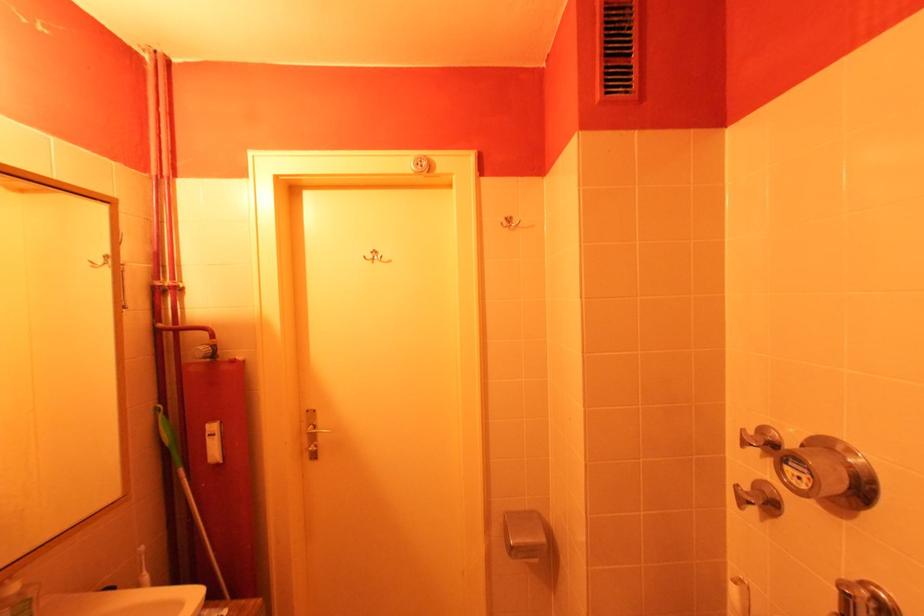
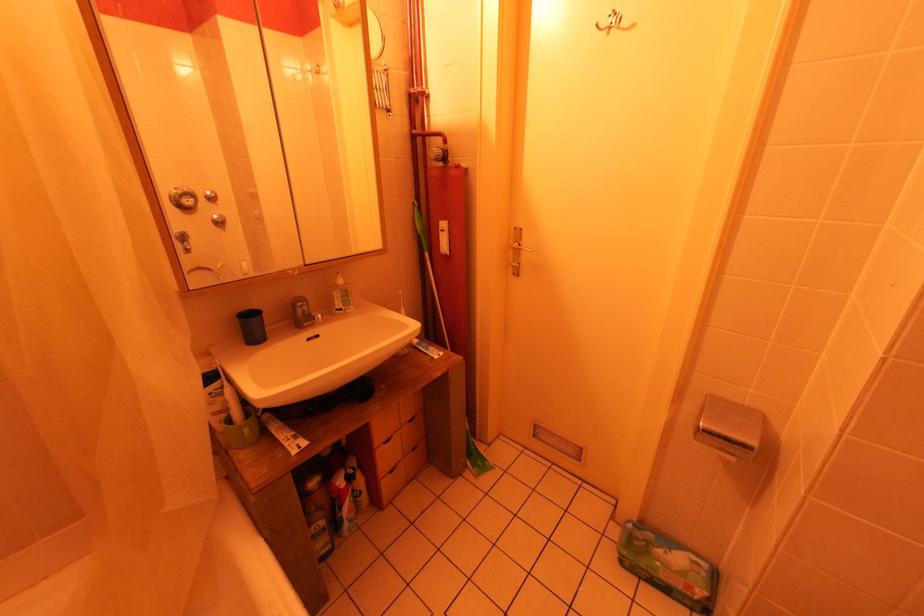
Based on the continuous images, in which direction is the camera rotating?

The camera's rotation is toward left-down.